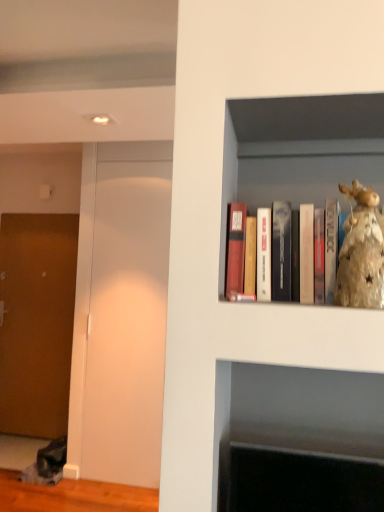
Question: Relative to transparent glass door at left, is shiny gold figurine at upper right in front or behind?

Choices:
 (A) front
 (B) behind

Answer: (A)

Question: In terms of size, does shiny gold figurine at upper right appear bigger or smaller than transparent glass door at left?

Choices:
 (A) small
 (B) big

Answer: (A)

Question: Which is farther from the shiny gold figurine at upper right?

Choices:
 (A) transparent glass door at left
 (B) brown textured door at left
 (C) matte wooden books at upper right

Answer: (B)

Question: Which is farther from the matte wooden books at upper right?

Choices:
 (A) transparent glass door at left
 (B) brown textured door at left
 (C) shiny gold figurine at upper right

Answer: (B)